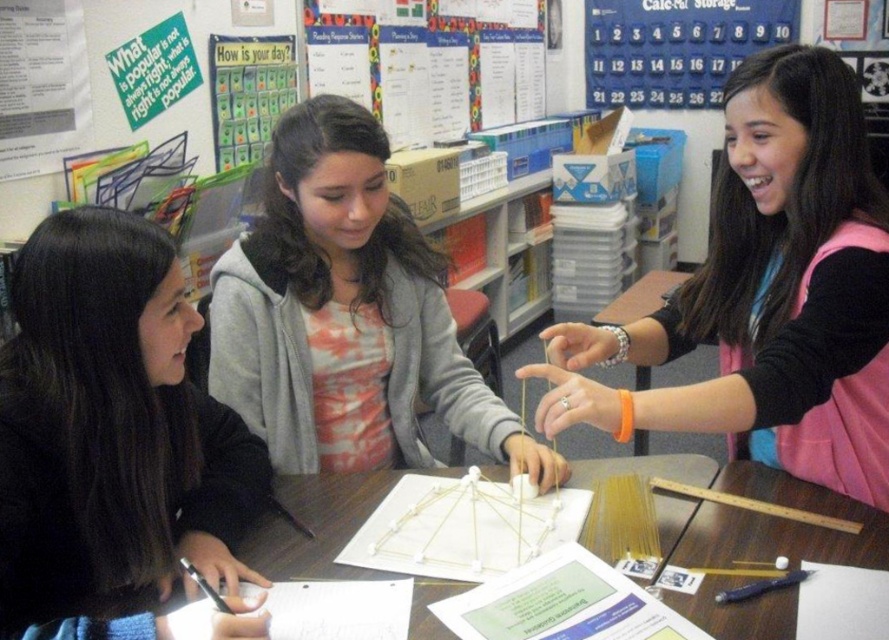
You are a student in the classroom looking at the black matte jacket at left and the orange wristband at upper right. Which object is positioned higher in the image?

The orange wristband at upper right is positioned higher than the black matte jacket at left.

You are a student trying to reach the orange wristband at upper right and the gray hoodie at center on the table. Which object is higher up in the image?

The orange wristband at upper right is much taller than the gray hoodie at center, so it is higher up in the image.

You are a student sitting at the wooden table at center. You notice an orange wristband at upper right. Can you reach it without leaving your seat?

The orange wristband at upper right is to the right of the wooden table at center, so if you are sitting at the wooden table at center, you might be able to reach it if it is within arm